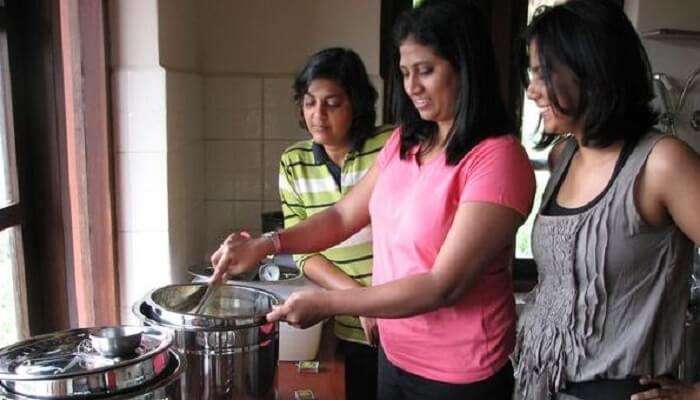
Locate an element on the screen. Image resolution: width=700 pixels, height=400 pixels. chrome pots is located at coordinates (232, 354), (148, 361).